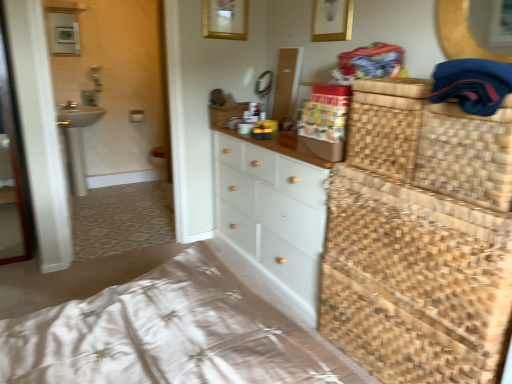
You are a GUI agent. You are given a task and a screenshot of the screen. Output one action in this format:
    pyautogui.click(x=<x>, y=<y>)
    Task: Click on the vacant space underneath white ceramic sink at left (from a real-world perspective)
    This screenshot has height=384, width=512.
    Given the screenshot: What is the action you would take?
    pyautogui.click(x=88, y=198)